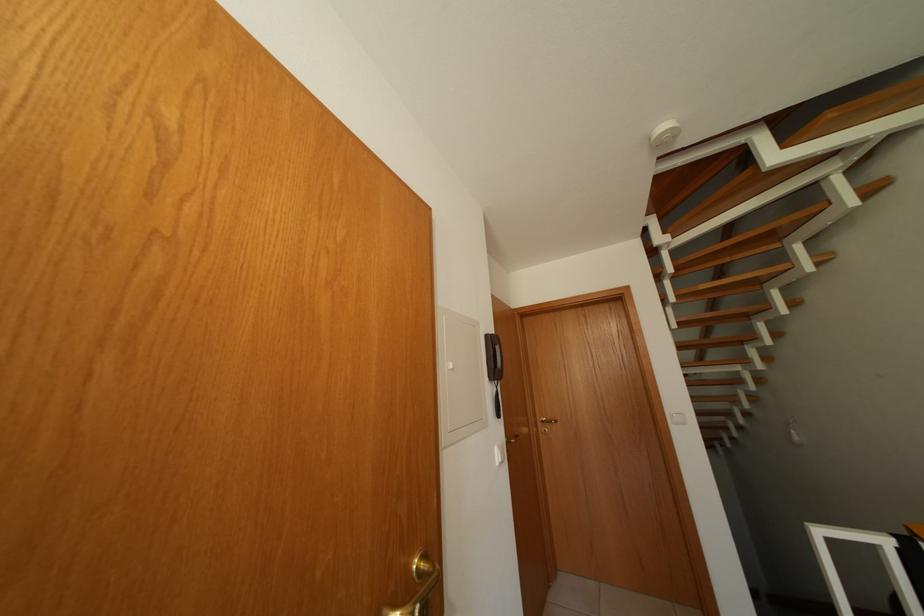
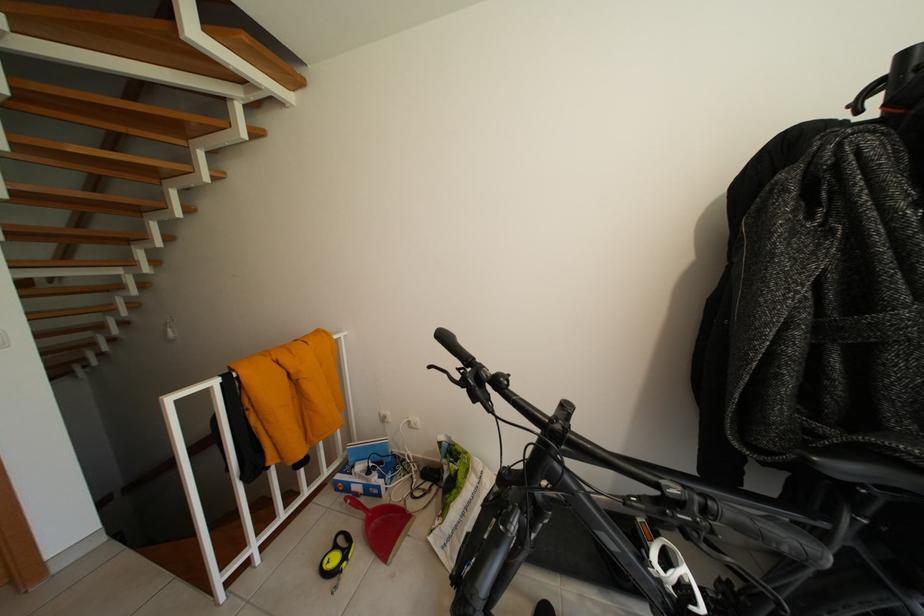
In the second image, find the point that corresponds to the point at 783,241 in the first image.

(190, 137)